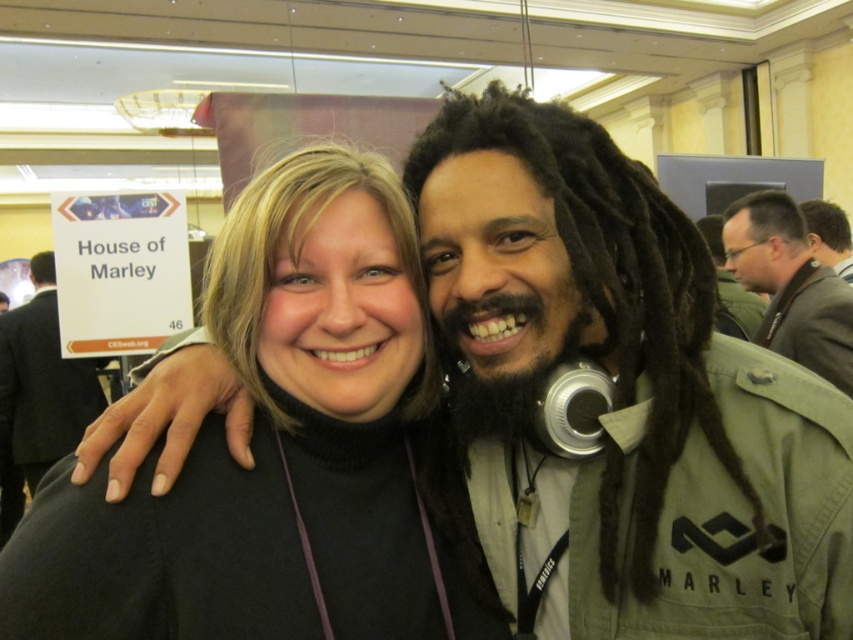
You are holding a 32 inch long measuring tape and want to measure the distance from your eyes to the point at coordinates (244, 368) in the image. Can you reach the point with your measuring tape?

The point at coordinates (244, 368) is 31.99 inches away from the viewer, so yes, the measuring tape can reach it since it is shorter than the tape length.

You are a photographer trying to adjust the lighting for a group photo. You notice the black turtleneck sweater at center and the matte gray jacket at upper right. Which item requires more vertical space in the frame to avoid being cut off?

The black turtleneck sweater at center requires more vertical space in the frame because it is much taller than the matte gray jacket at upper right.

You are a photographer trying to capture a group photo of the black turtleneck sweater at center and the matte gray jacket at upper right. The camera you are using has a minimum focusing distance of 2 meters. Will you be able to take a clear photo of both subjects without moving them?

The distance between the black turtleneck sweater at center and the matte gray jacket at upper right is 1.92 meters. Since the camera requires a minimum focusing distance of 2 meters, you will need to move them slightly farther apart to ensure both subjects are in focus.